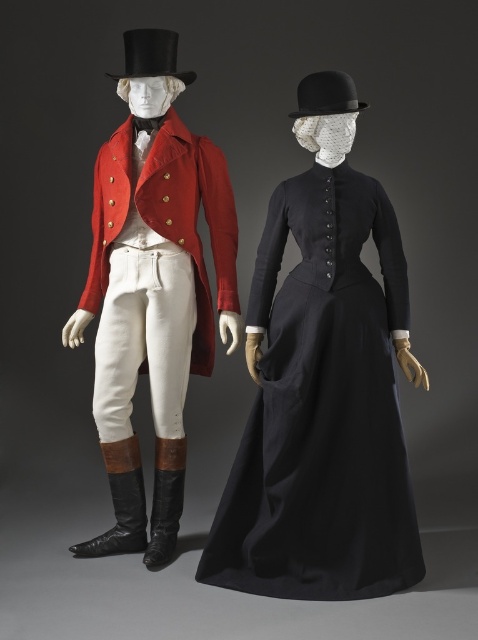
You are a costume designer preparing for a historical play. You have two items in front of you, the matte red coat at center and the black felt top hat at upper center. Which item would require more fabric to create?

The matte red coat at center requires more fabric than the black felt top hat at upper center because it is larger in size.

You are a fashion designer observing the two mannequins. You need to place a decorative ribbon between the matte red coat at left and the black felt top hat at upper center. According to their positions, where should you place the ribbon?

The matte red coat at left is to the left of the black felt top hat at upper center, so the ribbon should be placed between them on the right side of the matte red coat at left and the left side of the black felt top hat at upper center.

You are a costume designer preparing for a historical play. You need to decide which item to place on a shelf that can only hold items smaller than the other. The items are the matte red coat at left and the black felt top hat at upper center. Which item should you choose to fit on the shelf?

The black felt top hat at upper center should be chosen because it is smaller than the matte red coat at left, making it suitable for the shelf.